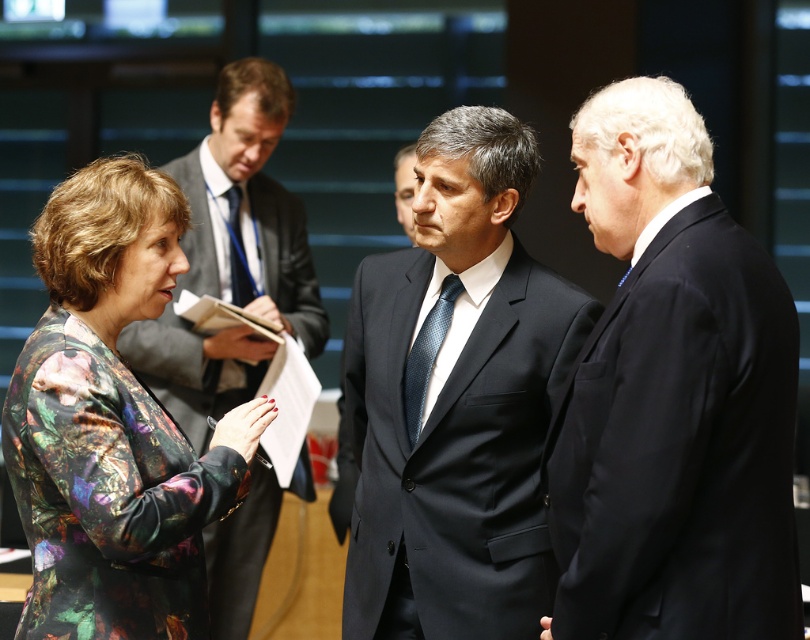
Question: Estimate the real-world distances between objects in this image. Which object is closer to the blue silk tie at center?

Choices:
 (A) printed fabric jacket at left
 (B) dark blue suit at center
 (C) dark blue textured tie at center
 (D) matte black suit at center

Answer: (B)

Question: Which object appears farthest from the camera in this image?

Choices:
 (A) blue silk tie at center
 (B) black suit at right
 (C) dark blue suit at center

Answer: (A)

Question: Does matte black suit at center have a lesser width compared to dark blue textured tie at center?

Choices:
 (A) yes
 (B) no

Answer: (B)

Question: Does black suit at right have a larger size compared to printed fabric jacket at left?

Choices:
 (A) no
 (B) yes

Answer: (B)

Question: Considering the real-world distances, which object is closest to the matte black suit at center?

Choices:
 (A) dark blue suit at center
 (B) dark blue textured tie at center

Answer: (B)

Question: Observing the image, what is the correct spatial positioning of black suit at right in reference to printed fabric jacket at left?

Choices:
 (A) below
 (B) above

Answer: (B)